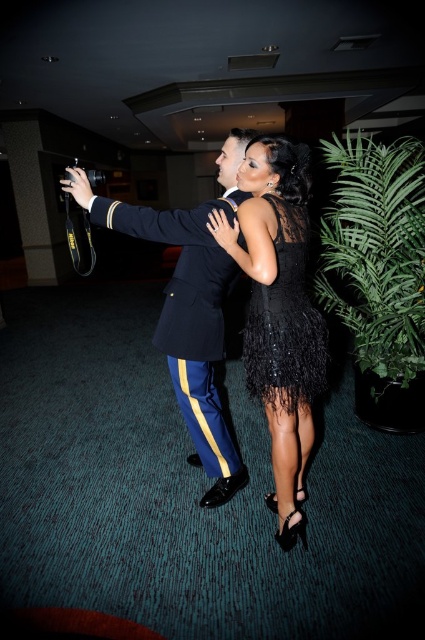
You are a photographer at the event and want to capture both the shiny black dress at center and the black feathered dress at center in the same frame. Which dress should you focus on first to ensure both are in the frame?

The shiny black dress at center is positioned under the black feathered dress at center, so you should focus on the black feathered dress at center first to ensure both are in the frame.

You are standing in the hallway and want to walk from the point marked as point (x=291, y=228) to the point marked as point (x=209, y=371). Which direction should you move in to reach your destination?

To move from point (x=291, y=228) to point (x=209, y=371), you should move forward since point (x=291, y=228) is in front of point (x=209, y=371).

You are a photographer at this event and need to ensure there is enough space between the black sequined dress at center and the black feathered dress at center for your camera lens to focus properly. The minimum focusing distance for your camera is 3 inches. Is the current distance sufficient?

The distance between the black sequined dress at center and the black feathered dress at center is 3.25 inches, which is greater than the camera lens minimum focusing distance of 3 inches. Therefore, the current spacing allows for proper focusing.